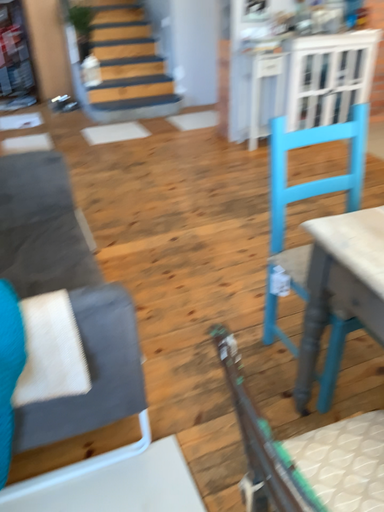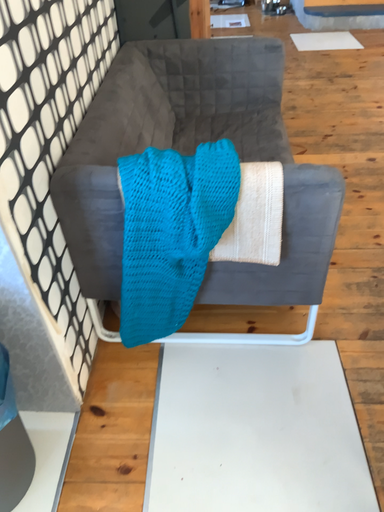
Question: Which way did the camera rotate in the video?

Choices:
 (A) rotated right
 (B) rotated left

Answer: (B)